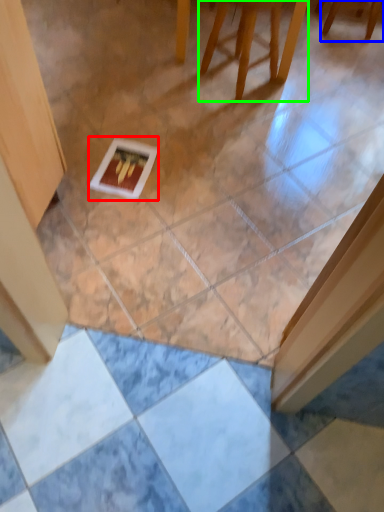
Question: Based on their relative distances, which object is farther from postcard (highlighted by a red box)? Choose from furniture (highlighted by a blue box) and furniture (highlighted by a green box).

Choices:
 (A) furniture
 (B) furniture

Answer: (A)